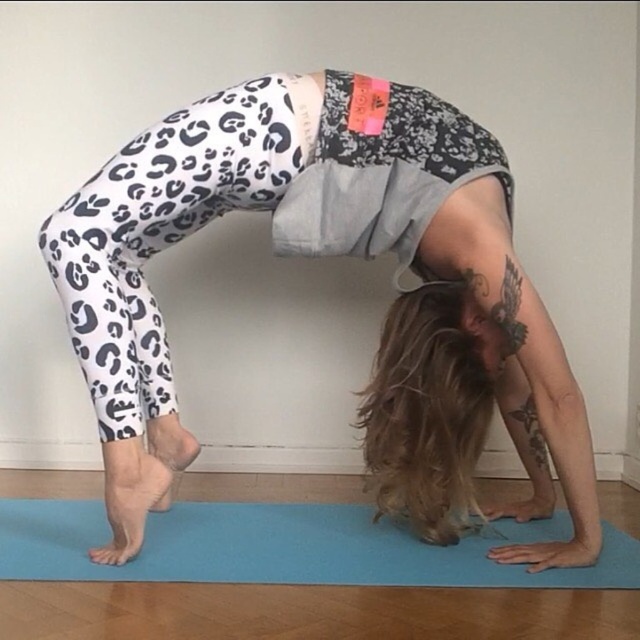
You are a photographer setting up a shoot in the room. You need to ensure the white leopard print leggings at center and the blue rubber mat at lower center are both visible in the frame. Based on their positions, which object should you adjust to the left to include both in the shot?

The white leopard print leggings at center is positioned on the right side of the blue rubber mat at lower center. To include both in the frame, you should adjust the white leopard print leggings at center to the left so that it moves closer to the blue rubber mat at lower center.